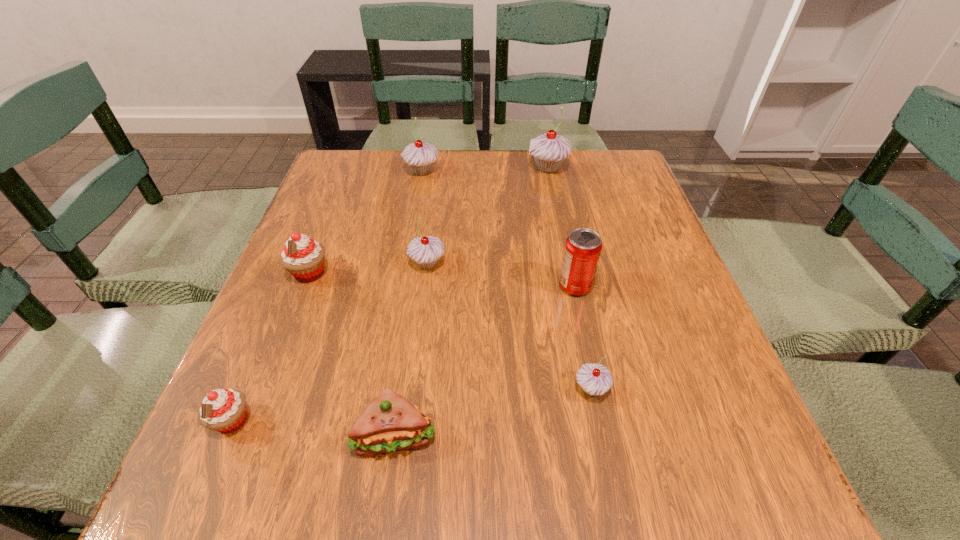
Find the location of `free spot at the right edge of the desktop`. free spot at the right edge of the desktop is located at coordinates (676, 301).

Locate an element on the screen. free space at the far left corner is located at coordinates (339, 153).

Where is `free space at the far right corner`? This screenshot has width=960, height=540. free space at the far right corner is located at coordinates (619, 182).

Where is `vacant point located between the red soda can and the second biggest gray cupcake`? The width and height of the screenshot is (960, 540). vacant point located between the red soda can and the second biggest gray cupcake is located at coordinates (498, 229).

Where is `free spot between the sandwich and the nearer pink cupcake`? This screenshot has height=540, width=960. free spot between the sandwich and the nearer pink cupcake is located at coordinates (313, 428).

The image size is (960, 540). Find the location of `empty space that is in between the biggest gray cupcake and the second biggest gray cupcake`. empty space that is in between the biggest gray cupcake and the second biggest gray cupcake is located at coordinates pyautogui.click(x=485, y=170).

Where is `free point between the third biggest gray cupcake and the biggest gray cupcake`? free point between the third biggest gray cupcake and the biggest gray cupcake is located at coordinates (488, 216).

Locate an element on the screen. free spot between the farther pink cupcake and the second smallest gray cupcake is located at coordinates [x=369, y=269].

In order to click on empty space between the bigger pink cupcake and the smallest gray cupcake in this screenshot , I will do `click(450, 331)`.

I want to click on empty location between the second smallest gray cupcake and the sandwich, so click(411, 349).